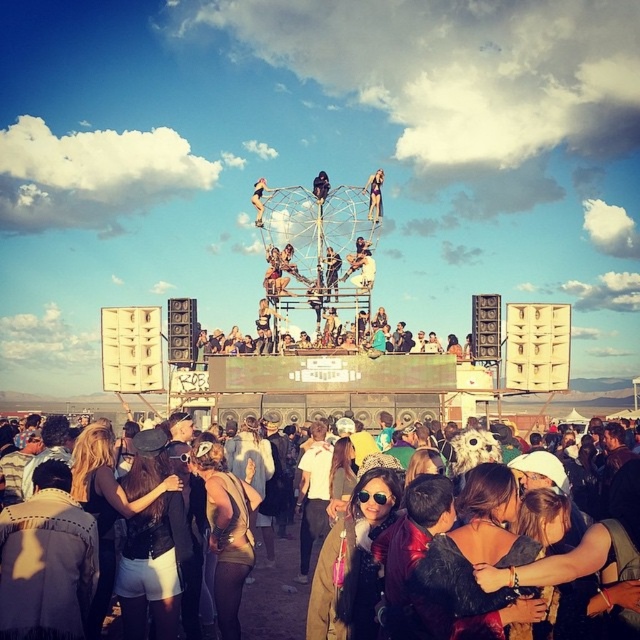
You are a festival attendee standing in the crowd and want to get a better view of the stage. The metallic silver microphone at center and the metallic silver figure at center are both in your line of sight. Which object is closer to the front of the stage?

The metallic silver microphone at center is to the right of the metallic silver figure at center, so the microphone is closer to the front of the stage.

Based on the photo, you are a photographer at the music festival and want to capture a photo that includes both the metallic silver microphone at center and the matte black bikini at center. Which object should you place on the right side of the other in your camera frame?

The metallic silver microphone at center should be placed on the right side of the matte black bikini at center because the metallic silver microphone at center is positioned on the right side of matte black bikini at center in the scene.

You are a photographer standing at the edge of the crowd. You want to take a photo of the matte black jacket at lower center and the metallic silver figure at center. Which object should you focus on first if you want to capture both in a single frame without moving the camera?

The matte black jacket at lower center is taller than the metallic silver figure at center, so you should focus on the matte black jacket at lower center first to ensure it fits within the frame.